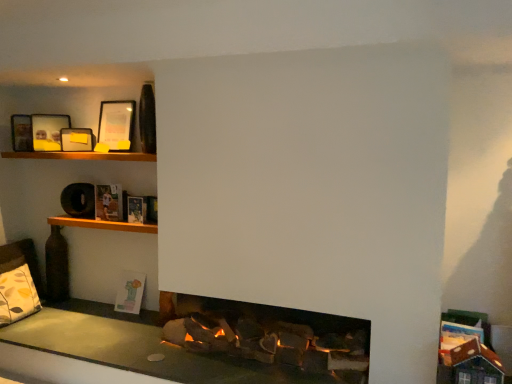
Question: Considering the positions of point (53, 152) and point (143, 283), is point (53, 152) closer or farther from the camera than point (143, 283)?

Choices:
 (A) closer
 (B) farther

Answer: (A)

Question: From a real-world perspective, is wooden shelf at upper left, placed as the 1th shelf when sorted from top to bottom, physically located above or below pastel paper book at lower left, positioned as the first book in bottom-to-top order?

Choices:
 (A) below
 (B) above

Answer: (B)

Question: Estimate the real-world distances between objects in this image. Which object is closer to the matte black picture frame at upper left, the first picture frame viewed from the right?

Choices:
 (A) wooden shelf at upper left, marked as the 1th shelf in a bottom-to-top arrangement
 (B) hardcover book at upper left, acting as the second book starting from the front
 (C) pastel paper book at lower left, which ranks as the 3th book in front-to-back order
 (D) wooden shelf at upper left, placed as the 1th shelf when sorted from top to bottom
 (E) patterned fabric pillow at lower left

Answer: (D)

Question: Based on their relative distances, which object is farther from the matte black picture frame at upper left, acting as the first picture frame starting from the left?

Choices:
 (A) wooden shelf at upper left, acting as the second shelf starting from the top
 (B) pastel paper book at lower left, the 3th book when ordered from top to bottom
 (C) patterned fabric pillow at lower left
 (D) wooden shelf at upper left, the second shelf when ordered from bottom to top
 (E) matte black picture frame at upper left, the third picture frame viewed from the left

Answer: (B)